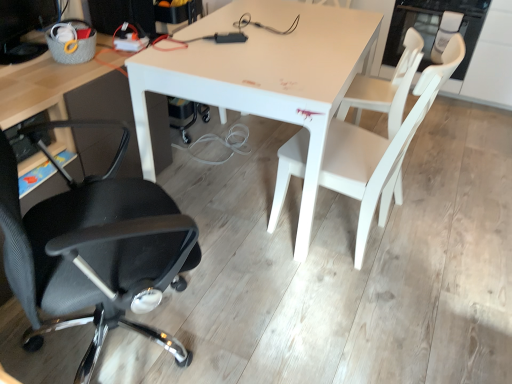
Question: From the image's perspective, relative to matte black computer monitor at upper left, is white matte chair at right, acting as the third chair starting from the left, above or below?

Choices:
 (A) above
 (B) below

Answer: (B)

Question: Is white matte chair at right, acting as the third chair starting from the left, wider or thinner than matte black computer monitor at upper left?

Choices:
 (A) thin
 (B) wide

Answer: (B)

Question: Which object is positioned closest to the black mesh office chair at left, which is counted as the 3th chair, starting from the right?

Choices:
 (A) white matte chair at right, which is the 1th chair from right to left
 (B) white matte table at center
 (C) white matte chair at center, the 2th chair in the left-to-right sequence
 (D) matte black computer monitor at upper left

Answer: (B)

Question: Based on their relative distances, which object is farther from the white matte chair at center, which is counted as the second chair, starting from the right?

Choices:
 (A) black mesh office chair at left, which is counted as the 3th chair, starting from the right
 (B) matte black computer monitor at upper left
 (C) white matte table at center
 (D) white matte chair at right, acting as the third chair starting from the left

Answer: (B)